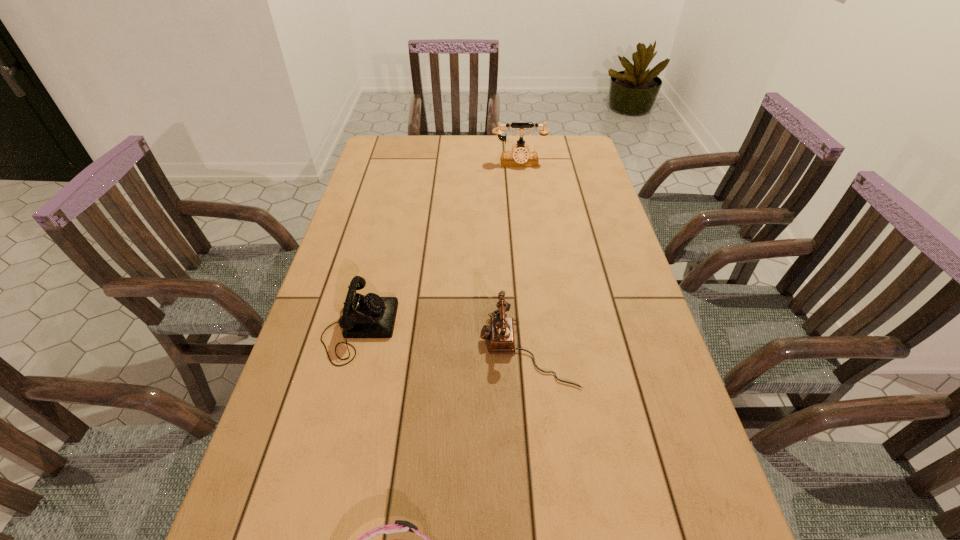
The width and height of the screenshot is (960, 540). Find the location of `the tallest object`. the tallest object is located at coordinates (521, 157).

Image resolution: width=960 pixels, height=540 pixels. What are the coordinates of `the tallest telephone` in the screenshot? It's located at (521, 157).

What are the coordinates of `the leftmost telephone` in the screenshot? It's located at (364, 316).

You are a GUI agent. You are given a task and a screenshot of the screen. Output one action in this format:
    pyautogui.click(x=<x>, y=<y>)
    Task: Click on the vacant region located on the dial of the farthest object
    The width and height of the screenshot is (960, 540).
    Given the screenshot: What is the action you would take?
    coord(527,228)

What are the coordinates of `free space located on the front face of the leftmost telephone` in the screenshot? It's located at (489, 328).

The height and width of the screenshot is (540, 960). I want to click on object that is at the far edge, so pos(521,157).

Identify the location of object that is at the left edge. (364, 316).

The image size is (960, 540). In the image, there is a desktop. Identify the location of vacant space at the far edge. (428, 165).

In the image, there is a desktop. Identify the location of free space at the left edge. (396, 185).

I want to click on blank space at the right edge of the desktop, so click(x=599, y=195).